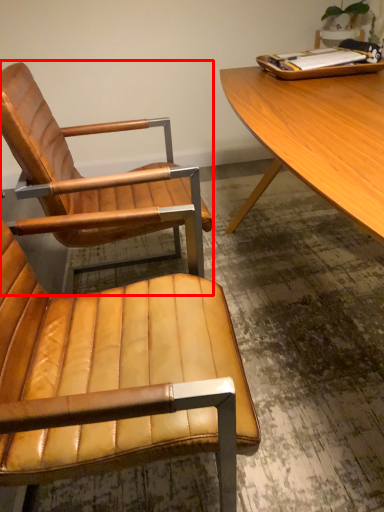
Question: Where is chair (annotated by the red box) located in relation to chair in the image?

Choices:
 (A) left
 (B) right

Answer: (A)